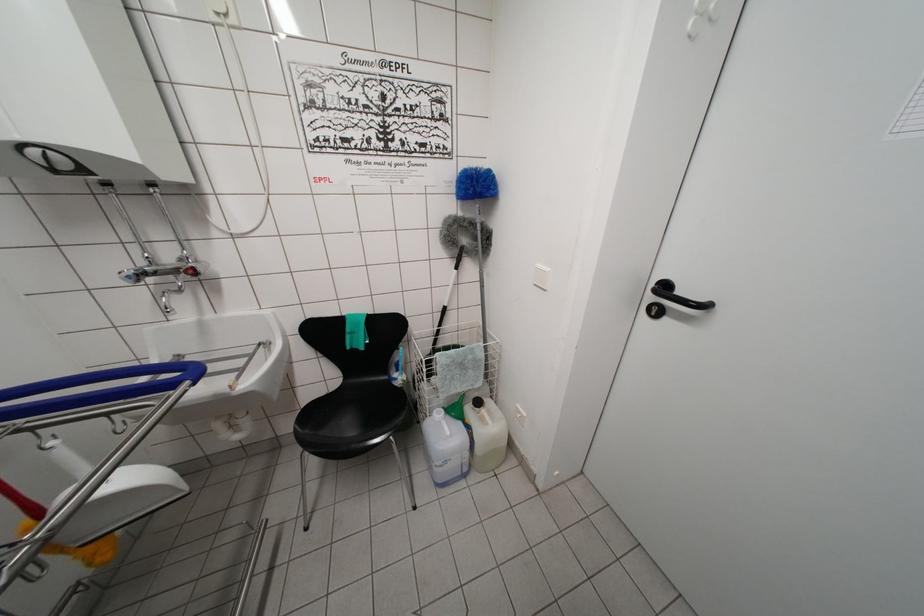
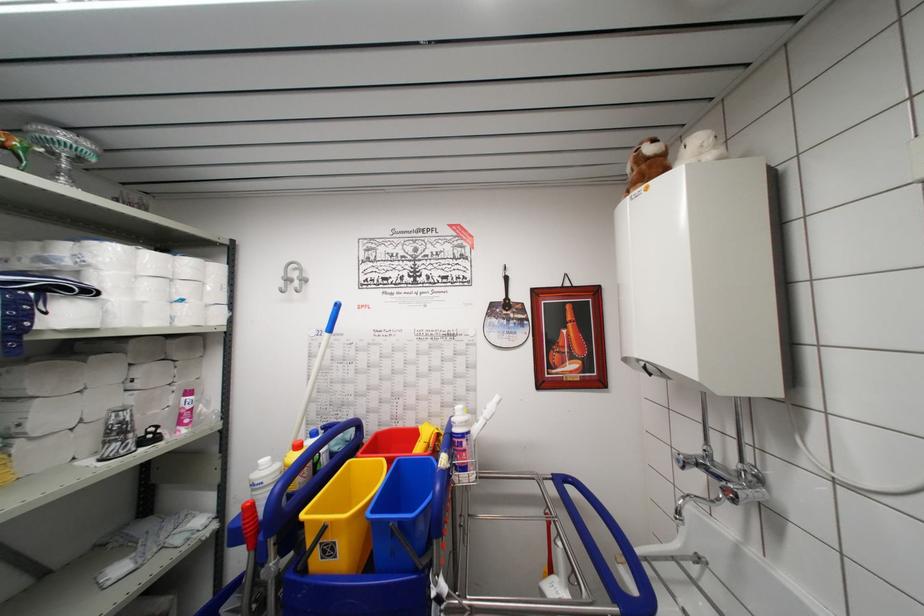
Question: The camera is either moving clockwise (left) or counter-clockwise (right) around the object. The first image is from the beginning of the video and the second image is from the end. Is the camera moving left or right when shooting the video?

Choices:
 (A) Left
 (B) Right

Answer: (B)